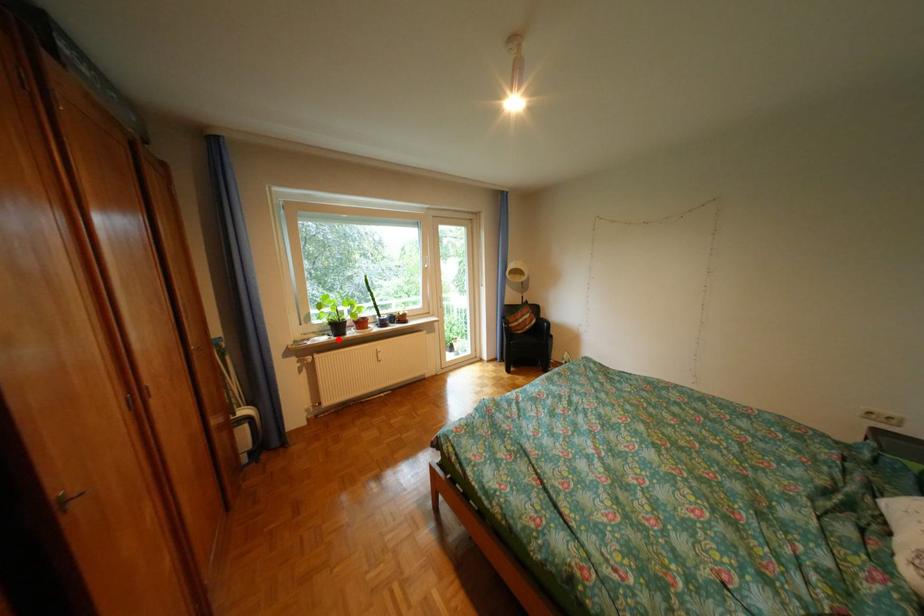
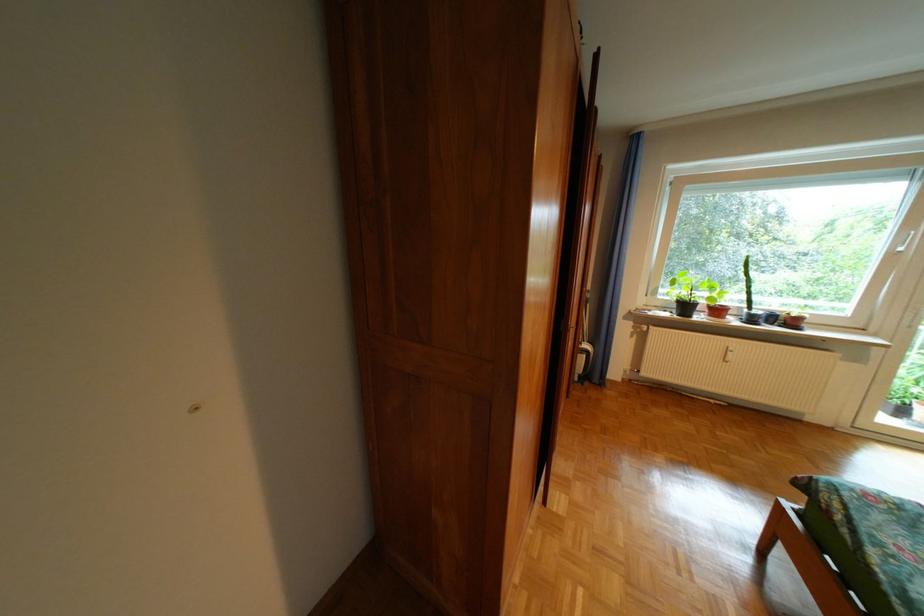
The point at the highlighted location is marked in the first image. Where is the corresponding point in the second image?

(679, 315)